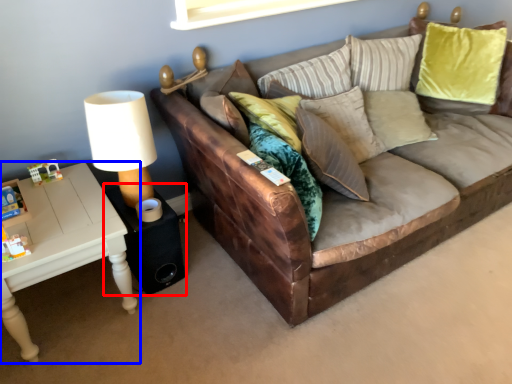
Question: Which of the following is the closest to the observer, side table (highlighted by a red box) or table (highlighted by a blue box)?

Choices:
 (A) side table
 (B) table

Answer: (B)